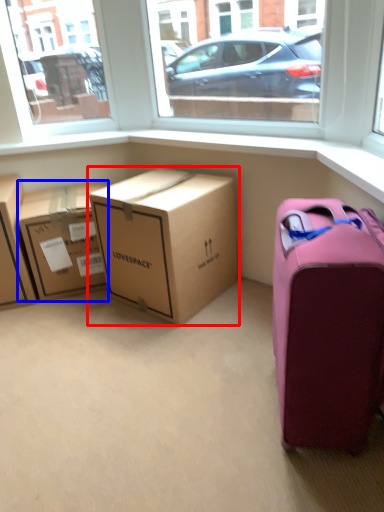
Question: Which of the following is the farthest to the observer, box (highlighted by a red box) or box (highlighted by a blue box)?

Choices:
 (A) box
 (B) box

Answer: (B)